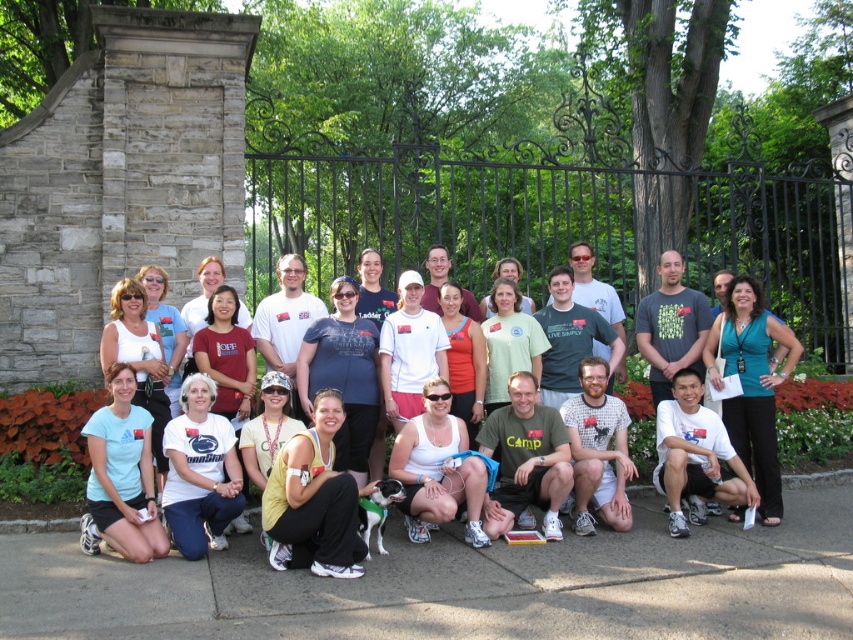
You are standing in front of the group photo setup in the park. There is a point marked at coordinates (343, 374) which corresponds to an object in the scene. What object is located at that point?

The point at coordinates (343, 374) marks the location of the matte blue tshirt at center.